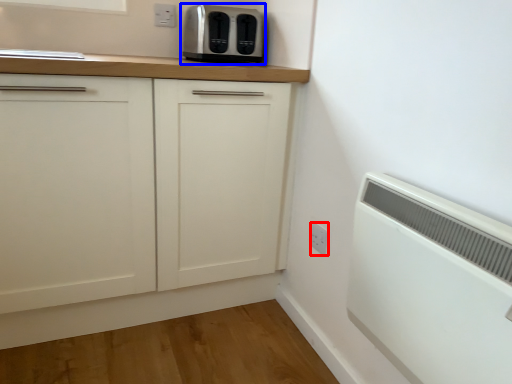
Question: Among these objects, which one is nearest to the camera, electric outlet (highlighted by a red box) or toaster (highlighted by a blue box)?

Choices:
 (A) electric outlet
 (B) toaster

Answer: (A)